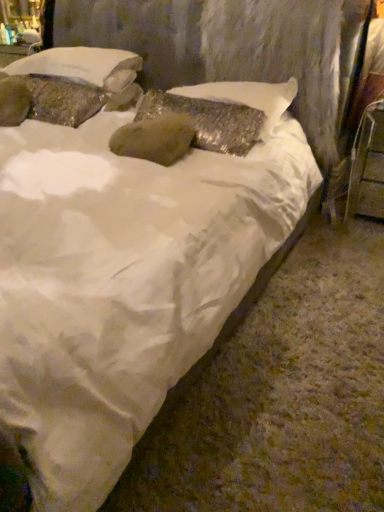
Question: Is shiny metallic pillow at center, placed as the 1th pillow when sorted from right to left, not within metallic silver chair at right?

Choices:
 (A) no
 (B) yes

Answer: (B)

Question: Considering the relative sizes of shiny metallic pillow at center, placed as the third pillow when sorted from left to right, and metallic silver chair at right in the image provided, is shiny metallic pillow at center, placed as the third pillow when sorted from left to right, wider than metallic silver chair at right?

Choices:
 (A) yes
 (B) no

Answer: (A)

Question: Considering the relative sizes of shiny metallic pillow at center, placed as the 1th pillow when sorted from right to left, and metallic silver chair at right in the image provided, is shiny metallic pillow at center, placed as the 1th pillow when sorted from right to left, bigger than metallic silver chair at right?

Choices:
 (A) no
 (B) yes

Answer: (B)

Question: Can you confirm if shiny metallic pillow at center, placed as the third pillow when sorted from left to right, is thinner than metallic silver chair at right?

Choices:
 (A) no
 (B) yes

Answer: (A)

Question: Is shiny metallic pillow at center, placed as the third pillow when sorted from left to right, smaller than metallic silver chair at right?

Choices:
 (A) yes
 (B) no

Answer: (B)

Question: Does shiny metallic pillow at center, placed as the third pillow when sorted from left to right, appear on the right side of metallic silver chair at right?

Choices:
 (A) no
 (B) yes

Answer: (A)

Question: Is textured stone pillow at upper left, acting as the 3th pillow starting from the right, shorter than textured stone pillow at upper left, placed as the 2th pillow when sorted from right to left?

Choices:
 (A) no
 (B) yes

Answer: (A)

Question: Is textured stone pillow at upper left, marked as the 1th pillow in a left-to-right arrangement, wider than textured stone pillow at upper left, arranged as the 2th pillow when viewed from the left?

Choices:
 (A) no
 (B) yes

Answer: (A)

Question: Is textured stone pillow at upper left, marked as the 1th pillow in a left-to-right arrangement, turned away from textured stone pillow at upper left, arranged as the 2th pillow when viewed from the left?

Choices:
 (A) no
 (B) yes

Answer: (B)

Question: From the image's perspective, is textured stone pillow at upper left, acting as the 3th pillow starting from the right, on top of textured stone pillow at upper left, placed as the 2th pillow when sorted from right to left?

Choices:
 (A) yes
 (B) no

Answer: (B)

Question: Can you confirm if textured stone pillow at upper left, marked as the 1th pillow in a left-to-right arrangement, is smaller than textured stone pillow at upper left, placed as the 2th pillow when sorted from right to left?

Choices:
 (A) yes
 (B) no

Answer: (A)

Question: From a real-world perspective, is textured stone pillow at upper left, marked as the 1th pillow in a left-to-right arrangement, positioned under textured stone pillow at upper left, arranged as the 2th pillow when viewed from the left, based on gravity?

Choices:
 (A) yes
 (B) no

Answer: (A)

Question: From a real-world perspective, is textured stone pillow at upper left, placed as the 2th pillow when sorted from right to left, located beneath shiny metallic pillow at center, placed as the third pillow when sorted from left to right?

Choices:
 (A) yes
 (B) no

Answer: (B)